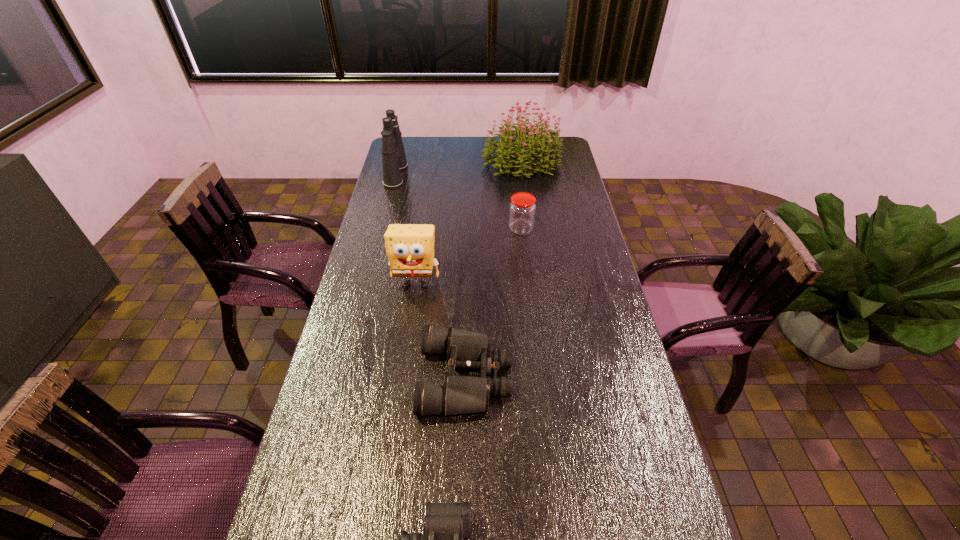
This screenshot has height=540, width=960. What are the coordinates of `bouquet` in the screenshot? It's located at (540, 154).

Where is `the leftmost object`? Image resolution: width=960 pixels, height=540 pixels. the leftmost object is located at coordinates (394, 160).

You are a GUI agent. You are given a task and a screenshot of the screen. Output one action in this format:
    pyautogui.click(x=<x>, y=<y>)
    Task: Click on the leftmost binoculars
    
    Given the screenshot: What is the action you would take?
    point(394,160)

At what (x,y) coordinates should I click in order to perform the action: click on the fourth farthest object. Please return your answer as a coordinate pair (x, y). The width and height of the screenshot is (960, 540). Looking at the image, I should click on click(x=410, y=247).

Where is `the third tallest object`? The image size is (960, 540). the third tallest object is located at coordinates (410, 247).

Image resolution: width=960 pixels, height=540 pixels. Find the location of `the third shortest object`. the third shortest object is located at coordinates (522, 209).

Where is `jar`? jar is located at coordinates (522, 209).

Locate an element on the screen. The image size is (960, 540). the fifth farthest object is located at coordinates (460, 394).

You are a GUI agent. You are given a task and a screenshot of the screen. Output one action in this format:
    pyautogui.click(x=<x>, y=<y>)
    Task: Click on the free region located 0.110m on the front of the bouquet
    The width and height of the screenshot is (960, 540).
    Given the screenshot: What is the action you would take?
    pyautogui.click(x=526, y=198)

Where is `free space located on the front of the farthest binoculars`? This screenshot has width=960, height=540. free space located on the front of the farthest binoculars is located at coordinates (388, 205).